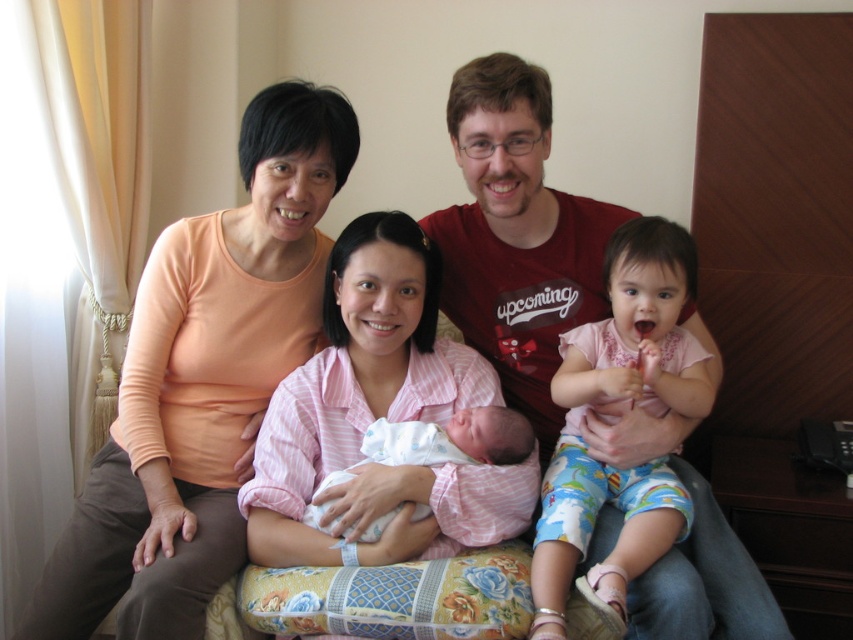
You are standing at the point marked by the coordinate point (502,464) and want to walk to the living room door located 1.62 meters away. Is the distance sufficient to reach the door without obstacles?

The distance between you and the living room door is exactly 1.62 meters, so yes, you can reach the door without any issues as there are no mentioned obstacles in the scene description.

You are standing in the living room and want to place a small potted plant between the two points marked as point (636,548) and point (387,518). Which point should the plant be closer to in order to be closer to the viewer?

The plant should be closer to point (636,548) because it is closer to the viewer than point (387,518).

You are standing at the point labeled as point (238, 461) in the image. You want to take a photo of the family using a camera that has a 1.5 meter minimum focusing distance. Can you take a clear photo of the family from this position?

The distance between point (238, 461) and the camera is 1.69 meters, which is greater than the camera 1.5 meter minimum focusing distance. Therefore, you can take a clear photo of the family from this position.